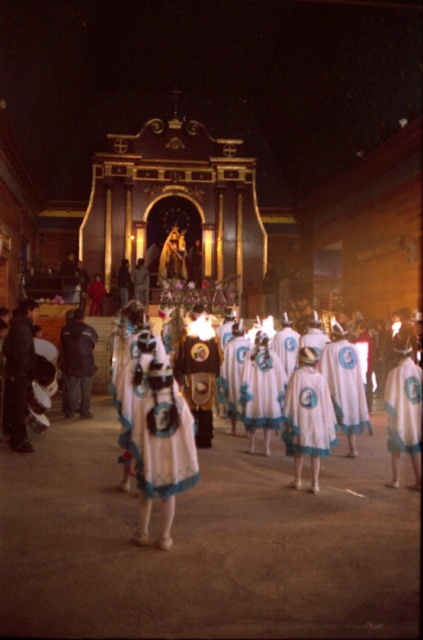
You are an attendee at the event and want to take a photo of both the white fabric dress at center and the white cotton dress at center. Which one should you focus on first to ensure both are in the frame?

You should focus on the white cotton dress at center first since it is behind the white fabric dress at center, allowing both to be captured in the frame.

You are standing at the entrance of the church and want to take a photo of the two points mentioned. Which point, point (175,474) or point (247,385), will appear larger in your photo?

Point (175,474) is closer to the camera than point (247,385), so it will appear larger in the photo.

You are a photographer standing at the back of the church near the altar. You want to take a photo of the two dresses mentioned. Can you fit both the white fabric dress at center and the white cotton dress at center in your camera frame if your camera has a maximum field of view of 15 meters?

The distance between the white fabric dress at center and the white cotton dress at center is 17.51 meters, which exceeds the camera field of view of 15 meters. Therefore, both dresses cannot be captured in a single frame.